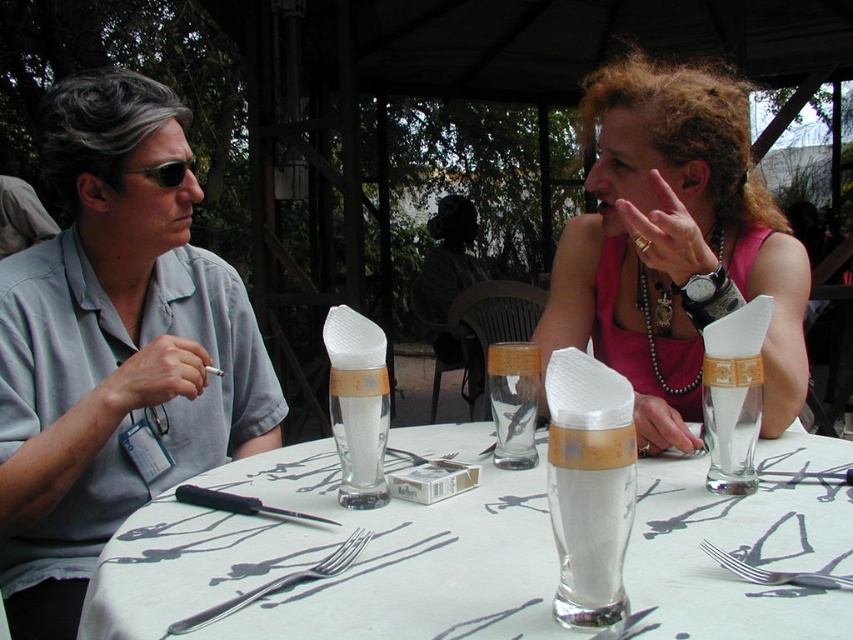
Is the position of pink fabric dress at upper right more distant than that of translucent glass at center?

Yes.

The image size is (853, 640). Describe the element at coordinates (674, 248) in the screenshot. I see `pink fabric dress at upper right` at that location.

Identify the location of pink fabric dress at upper right. (674, 248).

Is white paper napkin at center positioned behind pink fabric dress at upper right?

No.

Is point (828, 561) positioned behind point (792, 305)?

No, it is in front of (792, 305).

Is point (321, 616) behind point (733, 196)?

No.

At what (x,y) coordinates should I click in order to perform the action: click on white paper napkin at center. Please return your answer as a coordinate pair (x, y). The height and width of the screenshot is (640, 853). Looking at the image, I should click on (328, 552).

Who is positioned more to the left, white paper napkin at center or silver metallic fork at center?

From the viewer's perspective, silver metallic fork at center appears more on the left side.

At what (x,y) coordinates should I click in order to perform the action: click on white paper napkin at center. Please return your answer as a coordinate pair (x, y). The height and width of the screenshot is (640, 853). Looking at the image, I should click on (328, 552).